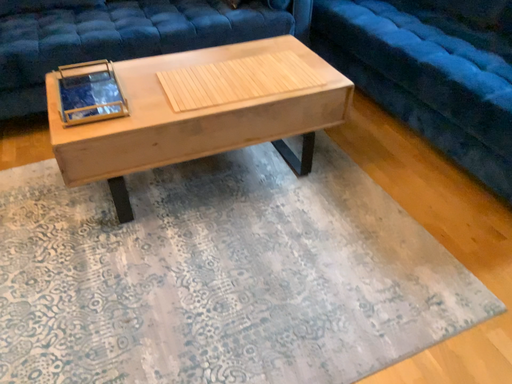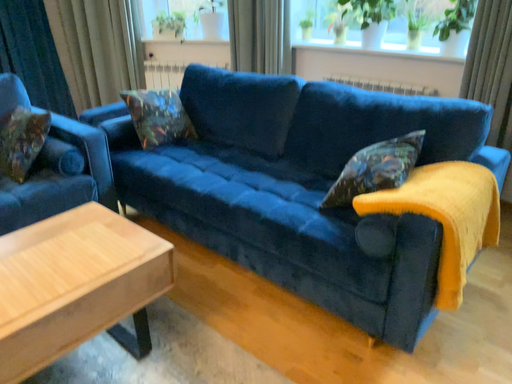
Question: Which way did the camera rotate in the video?

Choices:
 (A) rotated upward
 (B) rotated downward

Answer: (A)